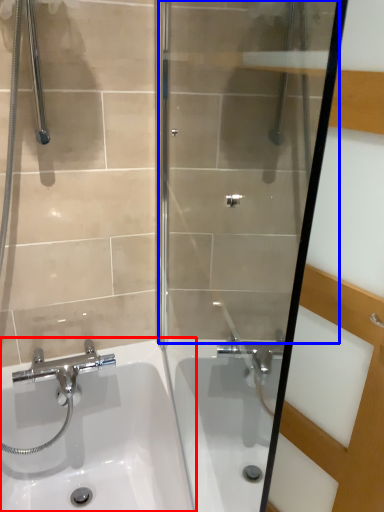
Question: Which object is closer to the camera taking this photo, sink (highlighted by a red box) or shower door (highlighted by a blue box)?

Choices:
 (A) sink
 (B) shower door

Answer: (B)